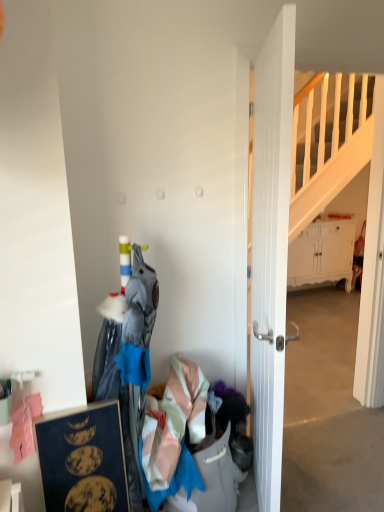
Question: Is dark blue matte picture frame at lower left located outside light pink satin dress at lower center?

Choices:
 (A) yes
 (B) no

Answer: (A)

Question: Is dark blue matte picture frame at lower left oriented away from light pink satin dress at lower center?

Choices:
 (A) yes
 (B) no

Answer: (B)

Question: Is dark blue matte picture frame at lower left thinner than light pink satin dress at lower center?

Choices:
 (A) yes
 (B) no

Answer: (A)

Question: Considering the relative positions of dark blue matte picture frame at lower left and light pink satin dress at lower center in the image provided, is dark blue matte picture frame at lower left to the left of light pink satin dress at lower center from the viewer's perspective?

Choices:
 (A) yes
 (B) no

Answer: (A)

Question: Is dark blue matte picture frame at lower left smaller than light pink satin dress at lower center?

Choices:
 (A) yes
 (B) no

Answer: (A)

Question: From a real-world perspective, does dark blue matte picture frame at lower left sit lower than light pink satin dress at lower center?

Choices:
 (A) yes
 (B) no

Answer: (B)

Question: Does white wooden door at center appear on the right side of white matte cabinet at right?

Choices:
 (A) yes
 (B) no

Answer: (B)

Question: Can you confirm if white wooden door at center is smaller than white matte cabinet at right?

Choices:
 (A) no
 (B) yes

Answer: (B)

Question: Considering the relative positions of white wooden door at center and white matte cabinet at right in the image provided, is white wooden door at center to the left of white matte cabinet at right from the viewer's perspective?

Choices:
 (A) yes
 (B) no

Answer: (A)

Question: Can you confirm if white wooden door at center is shorter than white matte cabinet at right?

Choices:
 (A) no
 (B) yes

Answer: (A)

Question: Could you tell me if white wooden door at center is turned towards white matte cabinet at right?

Choices:
 (A) yes
 (B) no

Answer: (B)

Question: Is white wooden door at center bigger than white matte cabinet at right?

Choices:
 (A) no
 (B) yes

Answer: (A)

Question: Considering the relative sizes of light pink satin dress at lower center and white matte cabinet at right in the image provided, is light pink satin dress at lower center wider than white matte cabinet at right?

Choices:
 (A) yes
 (B) no

Answer: (A)